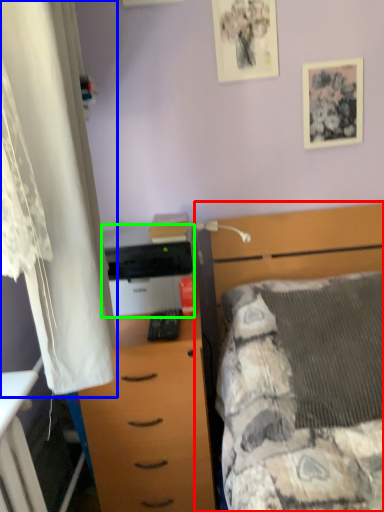
Question: Which is farther away from bed (highlighted by a red box)? curtain (highlighted by a blue box) or printer (highlighted by a green box)?

Choices:
 (A) curtain
 (B) printer

Answer: (A)